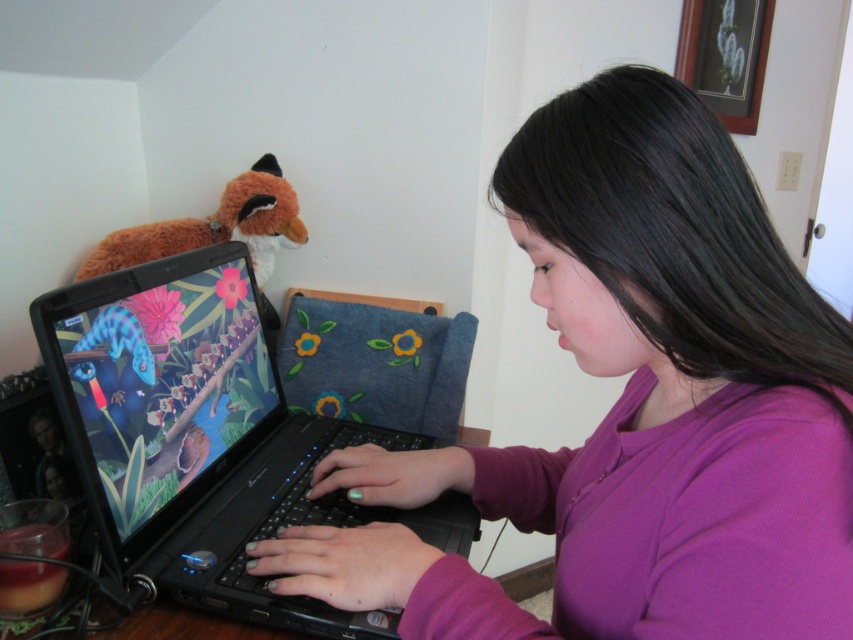
Question: Which is farther from the purple matte shirt at center?

Choices:
 (A) fuzzy orange fox at upper left
 (B) black plastic laptop at center

Answer: (A)

Question: Can you confirm if purple matte shirt at center is positioned below fuzzy orange fox at upper left?

Choices:
 (A) no
 (B) yes

Answer: (B)

Question: Does black plastic laptop at center have a greater width compared to fuzzy orange fox at upper left?

Choices:
 (A) no
 (B) yes

Answer: (B)

Question: Observing the image, what is the correct spatial positioning of black plastic laptop at center in reference to fuzzy orange fox at upper left?

Choices:
 (A) below
 (B) above

Answer: (A)

Question: Which point appears closest to the camera in this image?

Choices:
 (A) (131, 326)
 (B) (126, 244)

Answer: (A)

Question: Considering the real-world distances, which object is closest to the black plastic laptop at center?

Choices:
 (A) fuzzy orange fox at upper left
 (B) purple matte shirt at center

Answer: (B)